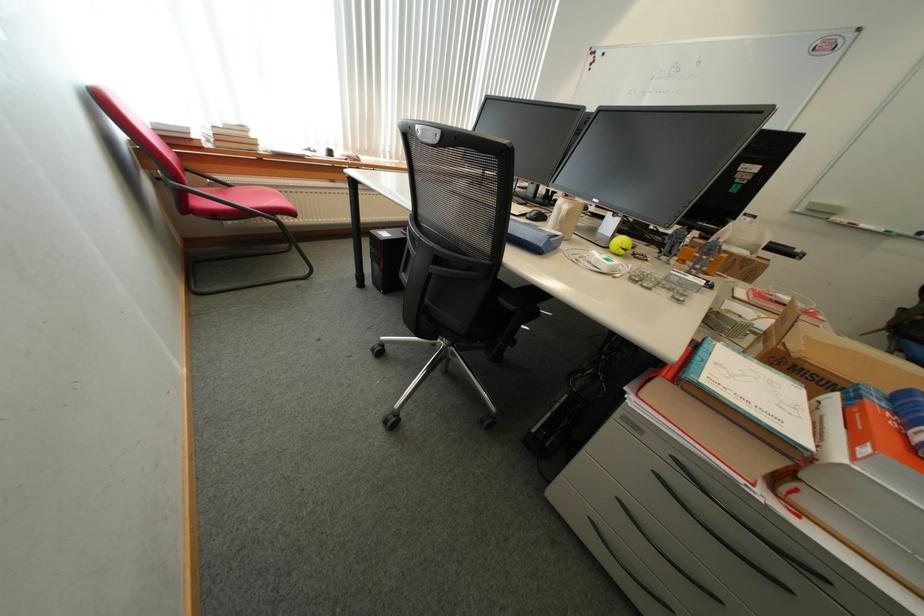
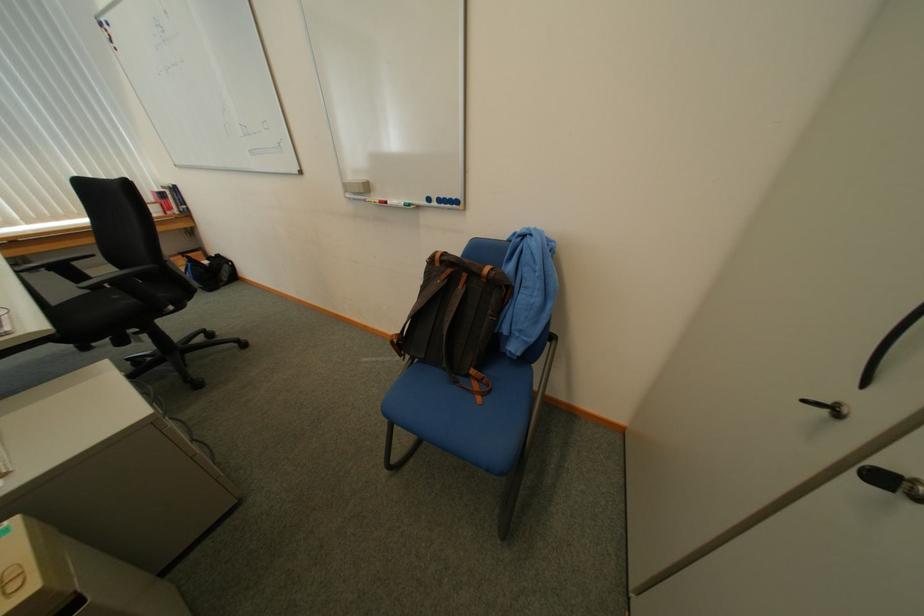
Find the pixel in the second image that matches [861,225] in the first image.

(396, 204)